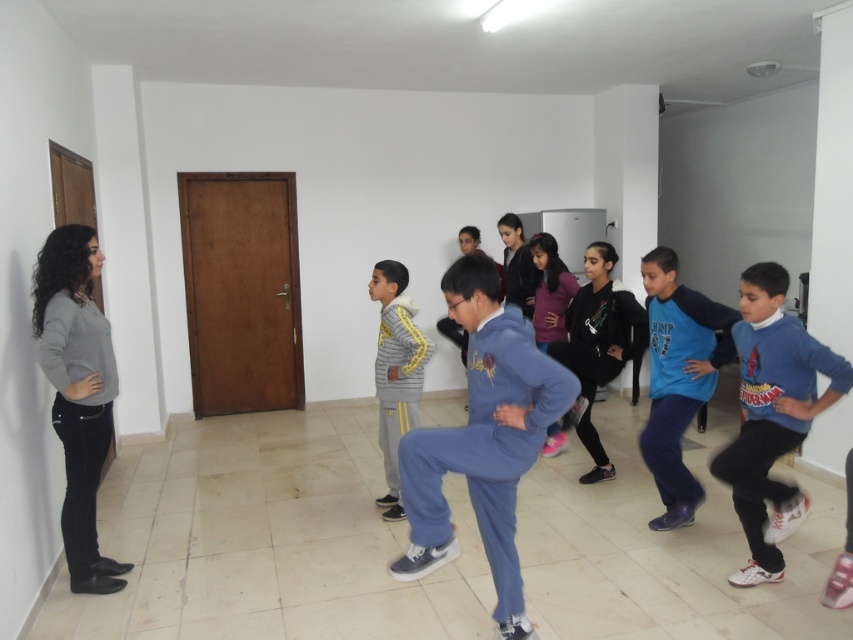
Question: Does gray matte sweater at left have a greater width compared to blue fleece jacket at center?

Choices:
 (A) yes
 (B) no

Answer: (B)

Question: Is gray matte sweater at left above black matte sweatshirt at center?

Choices:
 (A) yes
 (B) no

Answer: (B)

Question: Which of the following is the farthest from the observer?

Choices:
 (A) (74, 554)
 (B) (686, 289)
 (C) (643, 312)
 (D) (519, 392)

Answer: (C)

Question: Which object is farther from the camera taking this photo?

Choices:
 (A) gray fleece jacket at center
 (B) blue cotton sweater at right
 (C) black matte sweatshirt at center
 (D) gray matte sweater at left

Answer: (C)

Question: Considering the real-world distances, which object is farthest from the black matte sweatshirt at center?

Choices:
 (A) gray matte sweater at left
 (B) blue cotton sweater at right

Answer: (A)

Question: From the image, what is the correct spatial relationship of blue fleece jacket at center in relation to black matte sweatshirt at center?

Choices:
 (A) right
 (B) left

Answer: (A)